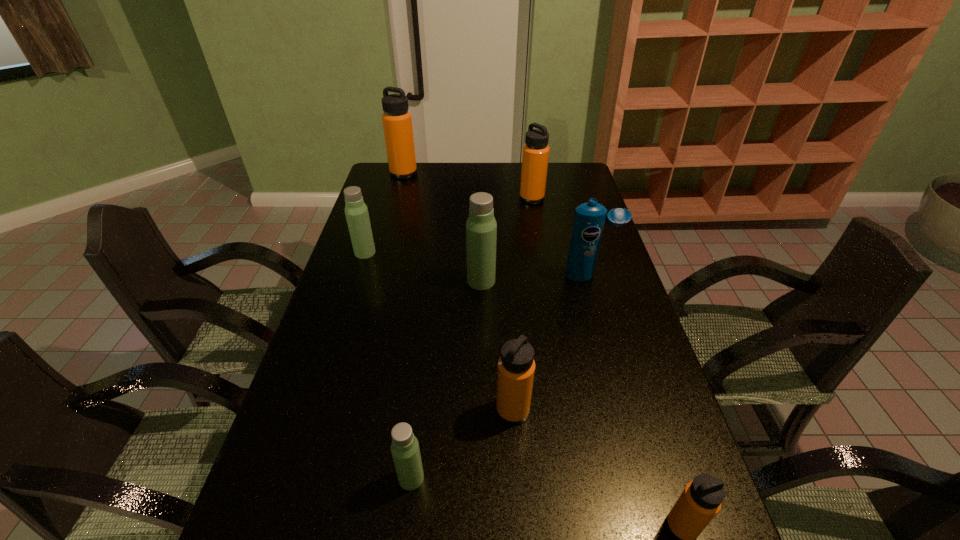
Where is `unoccupied area between the rightmost light thermos bottle and the tallest object`? unoccupied area between the rightmost light thermos bottle and the tallest object is located at coordinates [x=443, y=227].

Find the location of a particular element. The image size is (960, 540). unoccupied position between the rightmost light thermos bottle and the farthest orange thermos bottle is located at coordinates 443,227.

Identify which object is the third closest to the rightmost light thermos bottle. Please provide its 2D coordinates. Your answer should be formatted as a tuple, i.e. [(x, y)], where the tuple contains the x and y coordinates of a point satisfying the conditions above.

[(516, 367)]

Point out which object is positioned as the second nearest to the fifth thermos bottle from right to left. Please provide its 2D coordinates. Your answer should be formatted as a tuple, i.e. [(x, y)], where the tuple contains the x and y coordinates of a point satisfying the conditions above.

[(700, 501)]

Where is `the third closest thermos bottle to the second nearest light thermos bottle`? Image resolution: width=960 pixels, height=540 pixels. the third closest thermos bottle to the second nearest light thermos bottle is located at coordinates (535, 155).

The width and height of the screenshot is (960, 540). I want to click on the third closest thermos bottle to the rightmost orange thermos bottle, so click(481, 227).

The height and width of the screenshot is (540, 960). I want to click on orange thermos bottle object that ranks as the second closest to the nearest orange thermos bottle, so click(535, 155).

This screenshot has width=960, height=540. I want to click on the third closest orange thermos bottle relative to the third biggest orange thermos bottle, so click(397, 121).

This screenshot has height=540, width=960. I want to click on the closest light thermos bottle to the second smallest light thermos bottle, so (481, 227).

Locate an element on the screen. Image resolution: width=960 pixels, height=540 pixels. light thermos bottle that is the closest to the third farthest object is located at coordinates (481, 227).